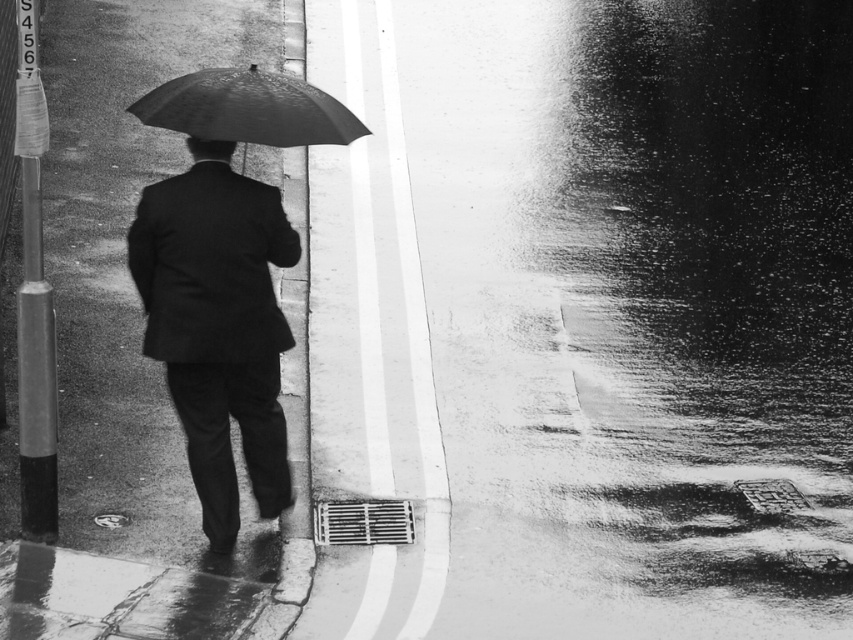
You are a photographer trying to capture the person in the matte black suit at center. The shiny black umbrella at center is blocking your view. Can you estimate whether the umbrella is taller than the person?

The matte black suit at center has a greater height compared to shiny black umbrella at center, so the umbrella is shorter than the person.

Consider the image. You are a photographer trying to capture the reflection of the shiny black umbrella at center in the wet pavement. Since the matte black suit at center is blocking your view, can you move to the right to get a clearer reflection?

The matte black suit at center is positioned on the left side of the shiny black umbrella at center. Moving to the right would allow you to see the reflection of the shiny black umbrella at center without obstruction from the matte black suit at center.

You are a photographer analyzing the composition of this rainy scene. You notice the matte black suit at center and the shiny black umbrella at center. Which object is positioned lower in the image?

The matte black suit at center is located below the shiny black umbrella at center, so the matte black suit at center is positioned lower in the image.